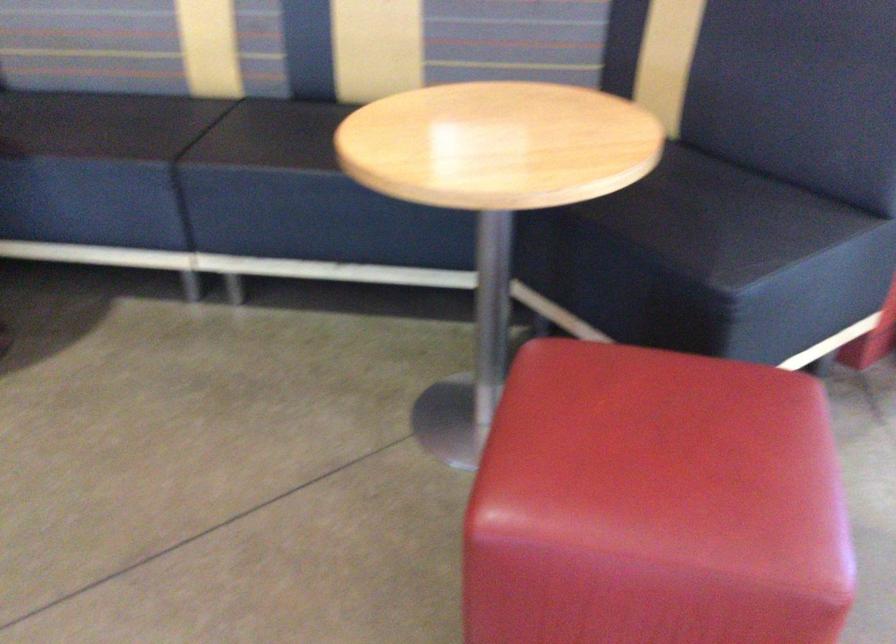
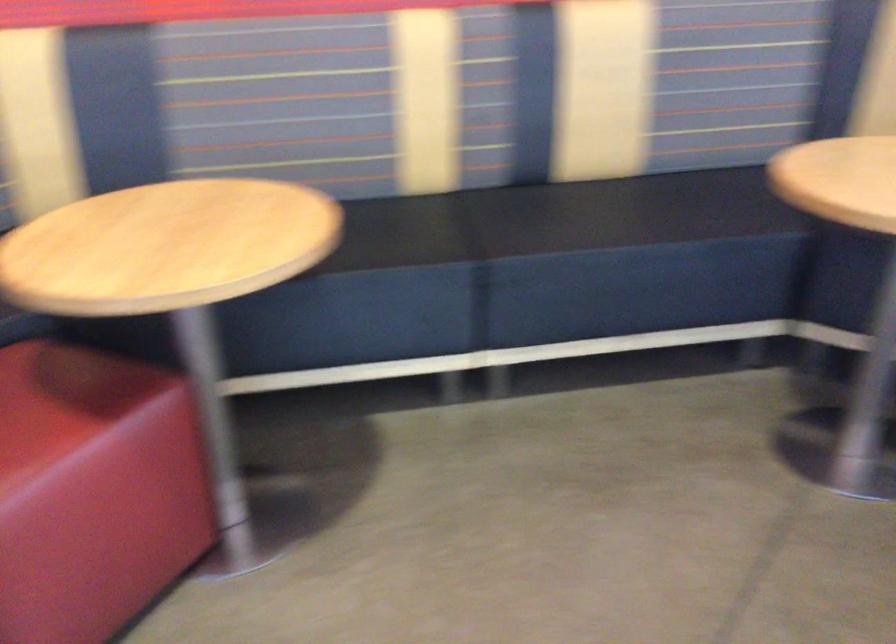
Question: What movement of the cameraman would produce the second image?

Choices:
 (A) Left
 (B) Right
 (C) Forward
 (D) Backward

Answer: (A)